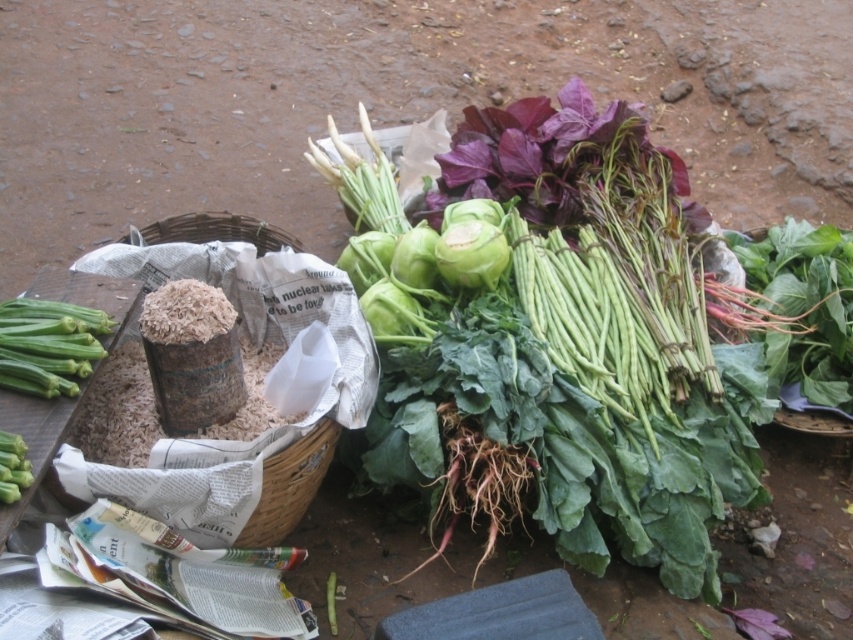
Question: Can you confirm if green leafy vegetables at center is wider than brown woven basket at left?

Choices:
 (A) no
 (B) yes

Answer: (B)

Question: Which of the following is the closest to the observer?

Choices:
 (A) green matte okra at lower left
 (B) brown woven basket at left

Answer: (A)

Question: In this image, where is brown woven basket at left located relative to green matte okra at lower left?

Choices:
 (A) left
 (B) right

Answer: (B)

Question: Which object is positioned farthest from the brown woven basket at left?

Choices:
 (A) green matte okra at lower left
 (B) green leafy vegetables at center

Answer: (B)

Question: Which of these objects is positioned farthest from the green leafy vegetables at center?

Choices:
 (A) brown woven basket at left
 (B) green matte okra at lower left

Answer: (B)

Question: From the image, what is the correct spatial relationship of brown woven basket at left in relation to green matte okra at lower left?

Choices:
 (A) right
 (B) left

Answer: (A)